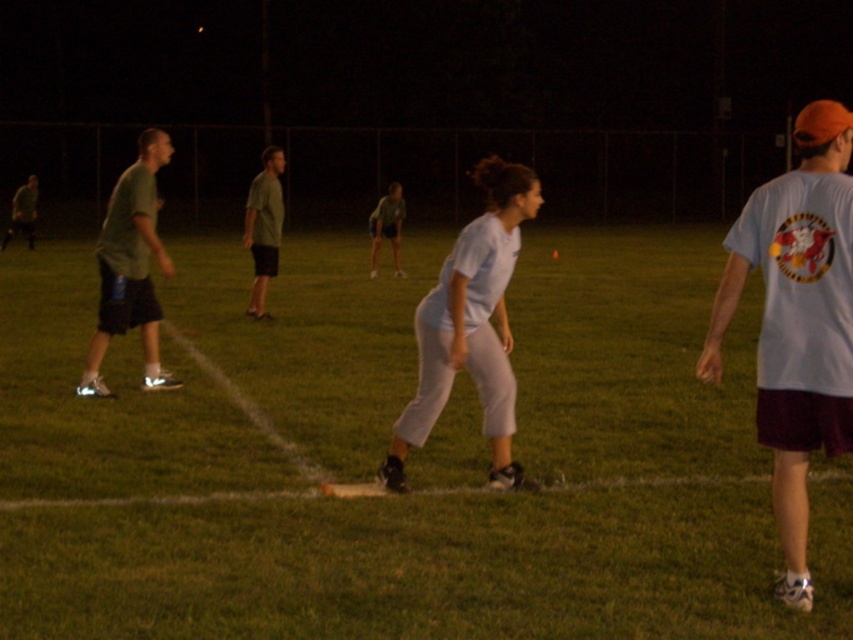
Based on the photo, between green grass football field at center and white matte t-shirt at right, which one is positioned higher?

Positioned higher is green grass football field at center.

Where is `green grass football field at center`? Image resolution: width=853 pixels, height=640 pixels. green grass football field at center is located at coordinates (334, 477).

Between matte green shirt at left and matte green shirt at center, which one appears on the right side from the viewer's perspective?

matte green shirt at center

Is matte green shirt at left above matte green shirt at center?

No.

Does point (90, 364) lie in front of point (247, 225)?

Yes, point (90, 364) is in front of point (247, 225).

This screenshot has width=853, height=640. In order to click on matte green shirt at left in this screenshot , I will do `click(131, 268)`.

Can you confirm if light blue fabric shorts at center is positioned above green matte shirt at left?

No.

Between point (376, 209) and point (4, 244), which one is positioned behind?

Positioned behind is point (4, 244).

Is point (368, 221) positioned in front of point (32, 205)?

No, it is behind (32, 205).

Locate an element on the screen. The width and height of the screenshot is (853, 640). light blue fabric shorts at center is located at coordinates (386, 227).